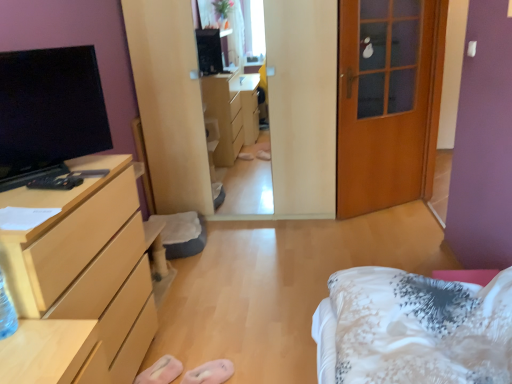
At what (x,y) coordinates should I click in order to perform the action: click on free location above light wood/finish chest of drawers at left (from a real-world perspective). Please return your answer as a coordinate pair (x, y). Looking at the image, I should click on (47, 182).